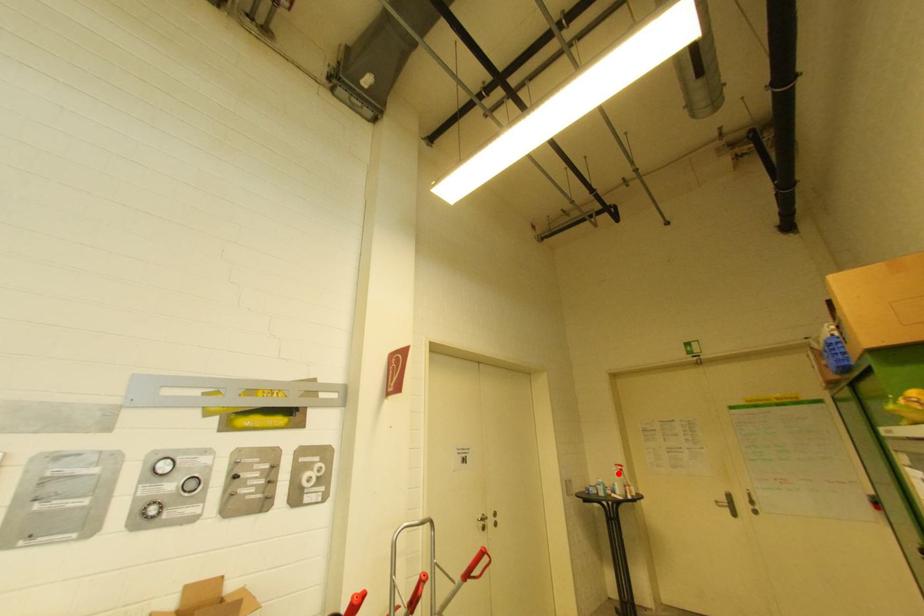
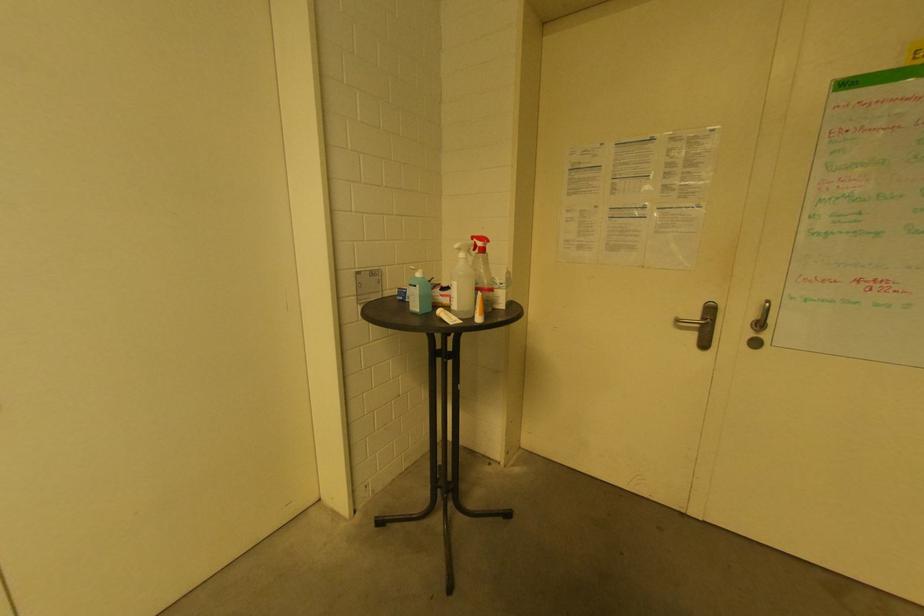
Question: I am providing you with two images of the same scene from different viewpoints. A red point is marked on the first image. At the location where the point appears in image 1, is it still visible in image 2?

Choices:
 (A) Yes
 (B) No

Answer: (A)